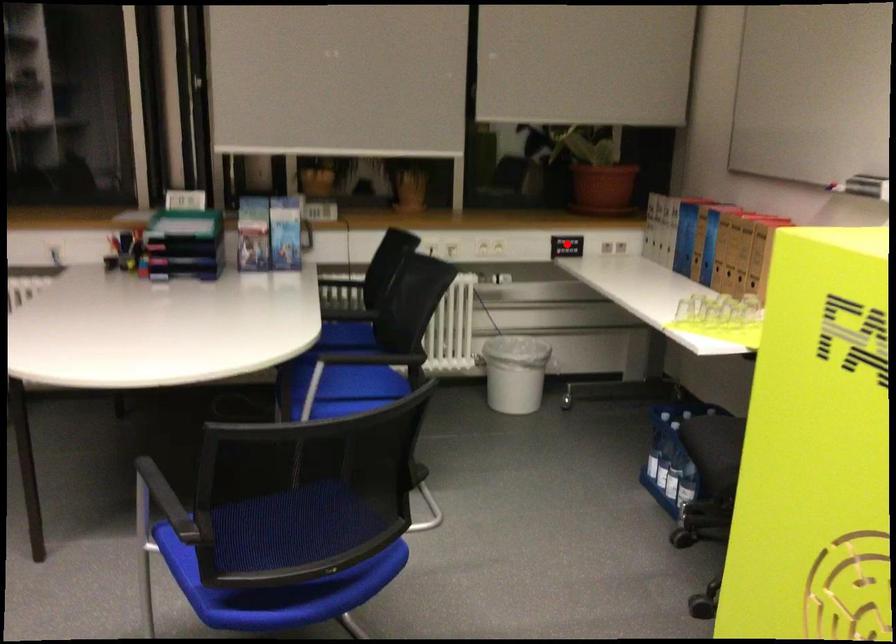
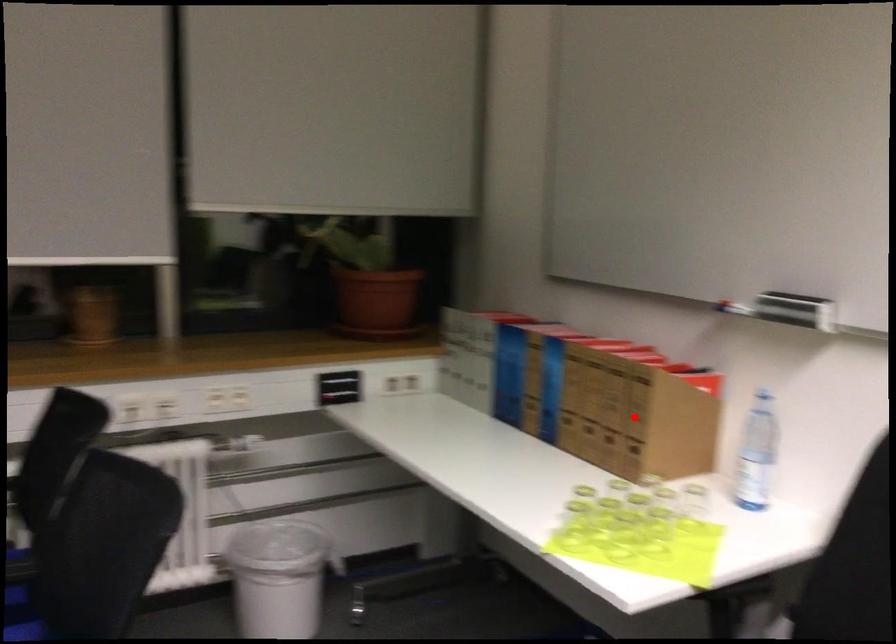
I am providing you with two images of the same scene from different viewpoints. A red point is marked on the first image and another point is marked on the second image. Are the points marked in image1 and image2 representing the same 3D position?

No